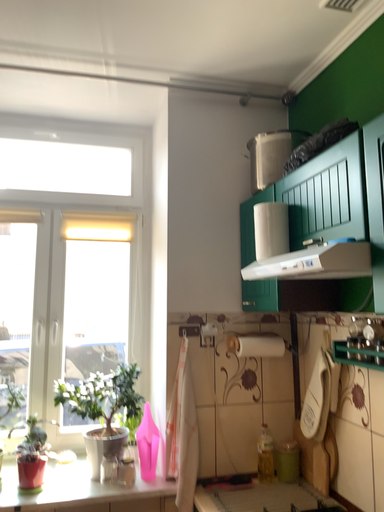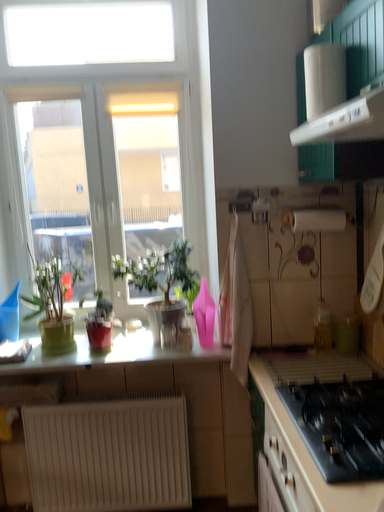
Question: How did the camera likely rotate when shooting the video?

Choices:
 (A) rotated right
 (B) rotated left

Answer: (B)